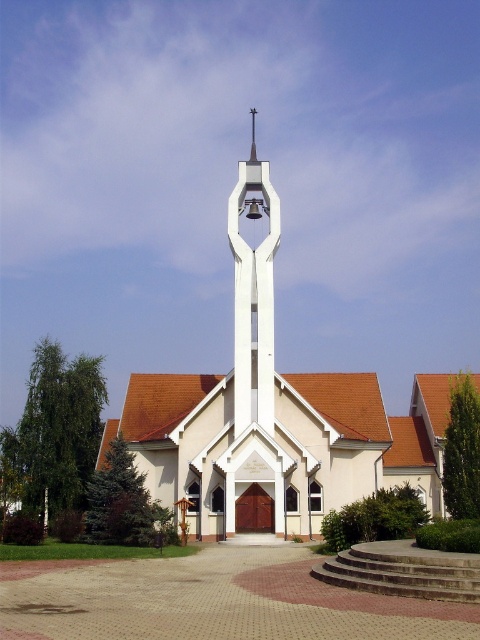
Question: Does white smooth church steeple at center have a smaller size compared to white smooth bell at center?

Choices:
 (A) yes
 (B) no

Answer: (B)

Question: Can you confirm if white smooth church steeple at center is positioned above white smooth bell at center?

Choices:
 (A) no
 (B) yes

Answer: (A)

Question: Which point is closer to the camera?

Choices:
 (A) white smooth church steeple at center
 (B) white smooth bell at center

Answer: (A)

Question: Which object appears farthest from the camera in this image?

Choices:
 (A) white smooth church steeple at center
 (B) white smooth bell at center

Answer: (B)

Question: Can you confirm if white smooth church steeple at center is positioned below white smooth bell at center?

Choices:
 (A) no
 (B) yes

Answer: (B)

Question: Among these objects, which one is farthest from the camera?

Choices:
 (A) white smooth bell at center
 (B) white smooth church steeple at center

Answer: (A)